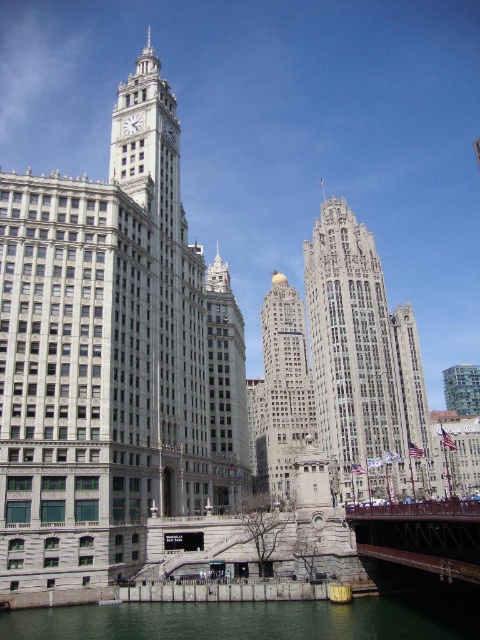
Is gray stone clock tower at center shorter than white marble clock at upper center?

No, gray stone clock tower at center is not shorter than white marble clock at upper center.

Can you confirm if gray stone clock tower at center is positioned to the right of white marble clock at upper center?

Incorrect, gray stone clock tower at center is not on the right side of white marble clock at upper center.

Does point (87, 506) lie in front of point (129, 116)?

Yes, it is.

In order to click on gray stone clock tower at center in this screenshot , I will do `click(112, 358)`.

Which is more to the right, gray stone clock tower at center or stone/brick skyscraper at center?

From the viewer's perspective, stone/brick skyscraper at center appears more on the right side.

Where is `gray stone clock tower at center`? The width and height of the screenshot is (480, 640). gray stone clock tower at center is located at coordinates (112, 358).

Locate an element on the screen. gray stone clock tower at center is located at coordinates (112, 358).

Is stone/brick skyscraper at center closer to camera compared to gold polished stone tower at center?

Yes, stone/brick skyscraper at center is in front of gold polished stone tower at center.

Based on the photo, can you confirm if stone/brick skyscraper at center is shorter than gold polished stone tower at center?

Correct, stone/brick skyscraper at center is not as tall as gold polished stone tower at center.

Find the location of `stone/brick skyscraper at center`. stone/brick skyscraper at center is located at coordinates (362, 364).

What are the coordinates of `stone/brick skyscraper at center` in the screenshot? It's located at (362, 364).